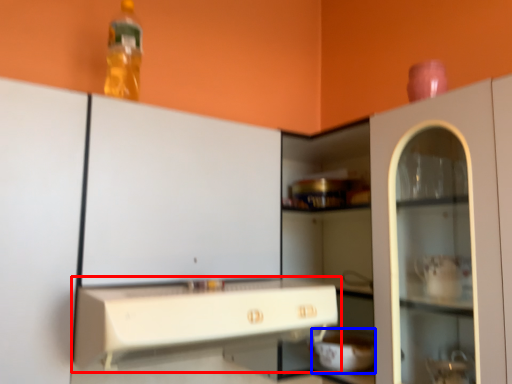
Question: Which object is closer to the camera taking this photo, countertop (highlighted by a red box) or appliance (highlighted by a blue box)?

Choices:
 (A) countertop
 (B) appliance

Answer: (A)